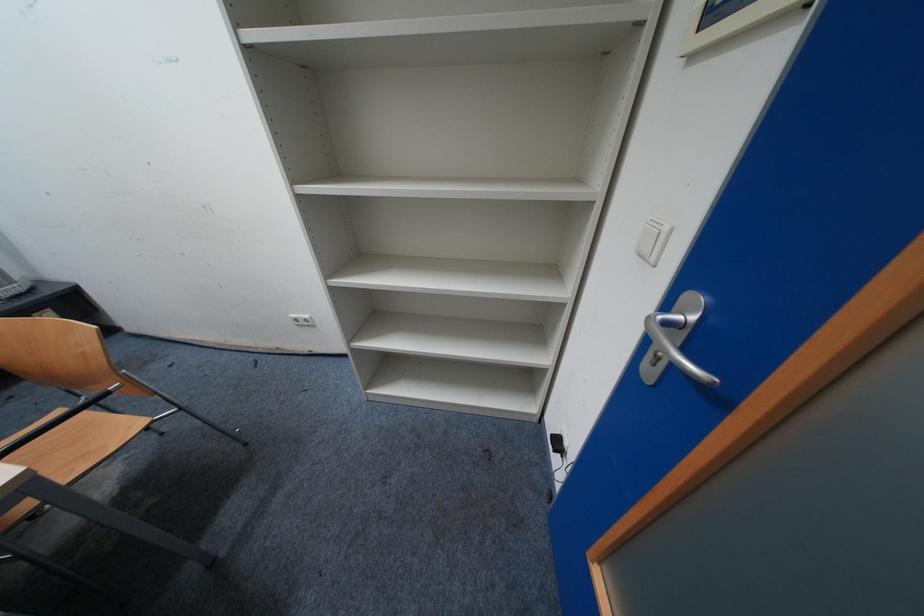
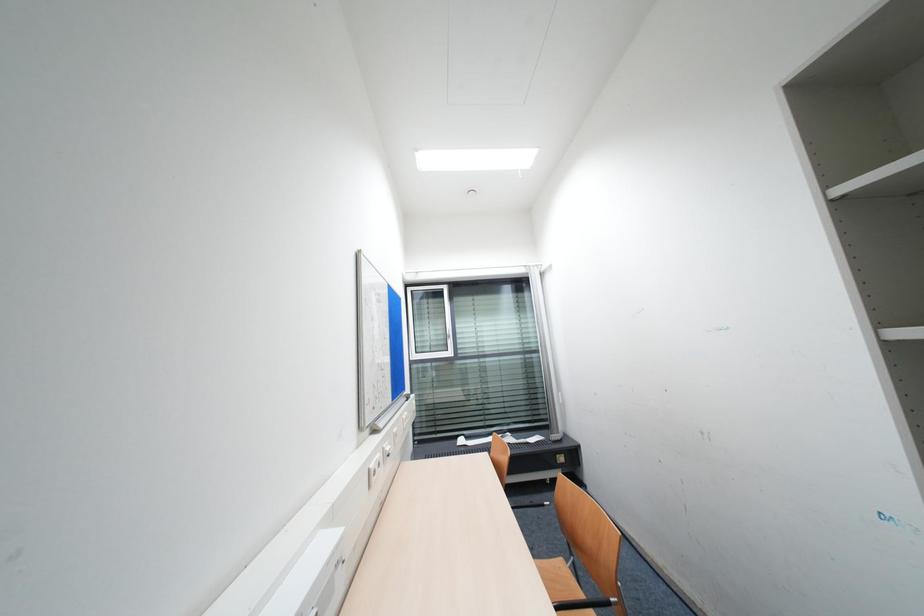
Question: The camera is either moving clockwise (left) or counter-clockwise (right) around the object. The first image is from the beginning of the video and the second image is from the end. Is the camera moving left or right when shooting the video?

Choices:
 (A) Left
 (B) Right

Answer: (B)